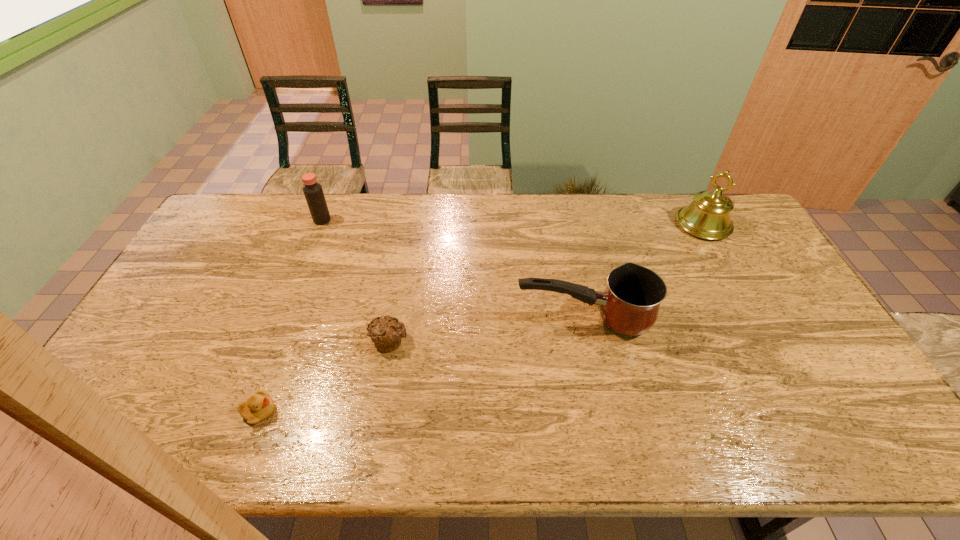
I want to click on free space between the vinegar and the nearest object, so click(291, 316).

Find the location of a particular element. This screenshot has height=540, width=960. vacant point located between the nearest object and the second object from right to left is located at coordinates (421, 365).

The image size is (960, 540). What are the coordinates of `vacant space that is in between the tallest object and the vinegar` in the screenshot? It's located at (513, 222).

Find the location of `the third closest object to the nearest object`. the third closest object to the nearest object is located at coordinates (313, 192).

Select which object appears as the closest to the second object from right to left. Please provide its 2D coordinates. Your answer should be formatted as a tuple, i.e. [(x, y)], where the tuple contains the x and y coordinates of a point satisfying the conditions above.

[(386, 333)]

Locate an element on the screen. Image resolution: width=960 pixels, height=540 pixels. free location that satisfies the following two spatial constraints: 1. on the front side of the bell; 2. on the handle side of the saucepan is located at coordinates (756, 319).